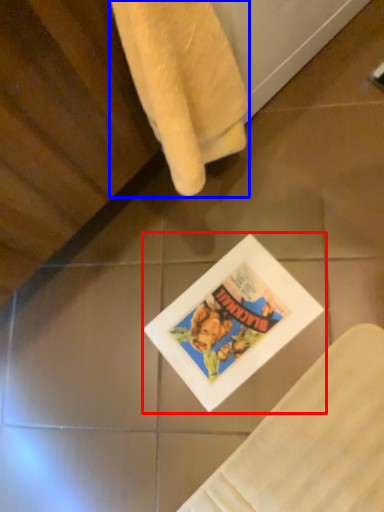
Question: Which object appears farthest to the camera in this image, comic book (highlighted by a red box) or towel (highlighted by a blue box)?

Choices:
 (A) comic book
 (B) towel

Answer: (A)